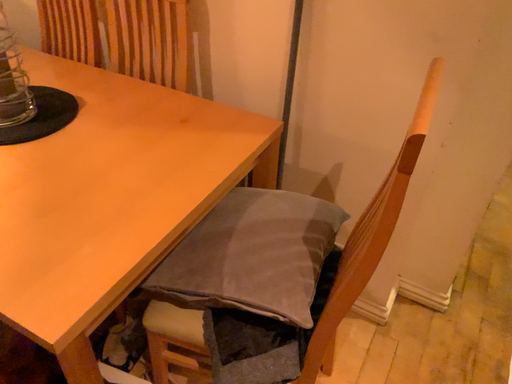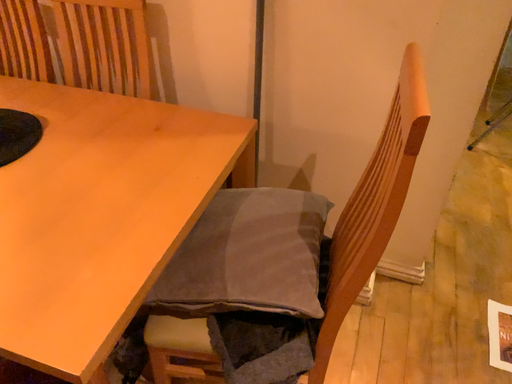
Question: How did the camera likely rotate when shooting the video?

Choices:
 (A) rotated left
 (B) rotated right

Answer: (B)